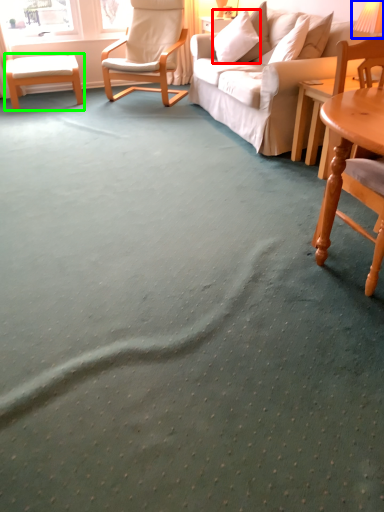
Question: Which object is the farthest from pillow (highlighted by a red box)? Choose among these: table lamp (highlighted by a blue box) or table (highlighted by a green box).

Choices:
 (A) table lamp
 (B) table

Answer: (B)